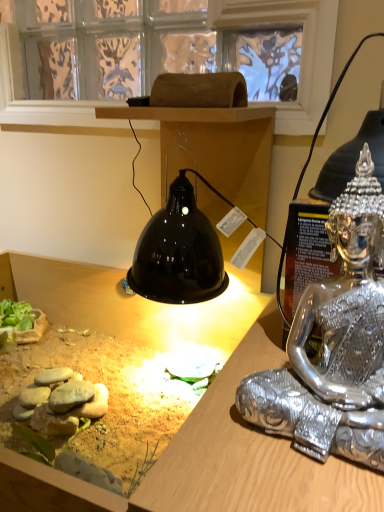
Question: Is point (289, 114) positioned closer to the camera than point (193, 435)?

Choices:
 (A) farther
 (B) closer

Answer: (A)

Question: Considering their positions, is transparent glass window screen at upper center located in front of or behind matte black lamp at upper center?

Choices:
 (A) front
 (B) behind

Answer: (B)

Question: Which is nearer to the transparent glass window screen at upper center?

Choices:
 (A) matte black lamp at upper center
 (B) silver metallic statue at right

Answer: (A)

Question: Which object is the closest to the silver metallic statue at right?

Choices:
 (A) matte black lamp at upper center
 (B) transparent glass window screen at upper center

Answer: (A)